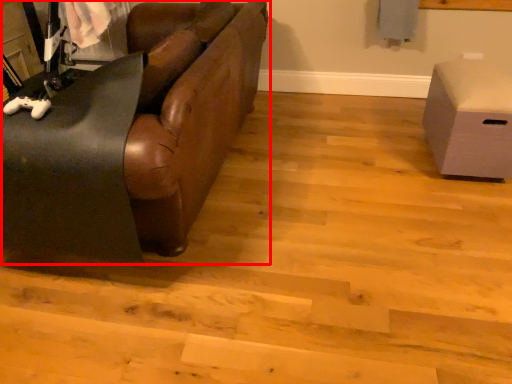
Question: In this image, where is studio couch (annotated by the red box) located relative to furniture?

Choices:
 (A) right
 (B) left

Answer: (B)